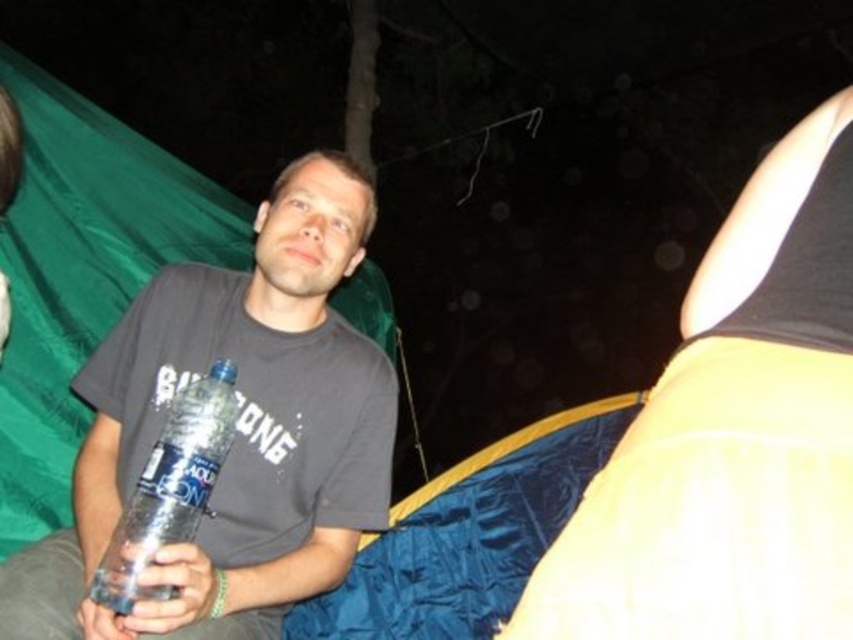
You are standing at the center of the image. Which direction should you look to see the matte yellow fabric at upper right?

The matte yellow fabric at upper right is located at coordinates 0.681 on the x axis and 0.860 on the y axis, so you should look to the upper right direction to see it.

You are navigating through a dark forest at night and see two glowing points of light in the distance. The first point is labeled as point [144,385] and the second is point [170,540]. According to the image, which point is closer to you?

Point [170,540] is closer to you because point [144,385] is behind it.